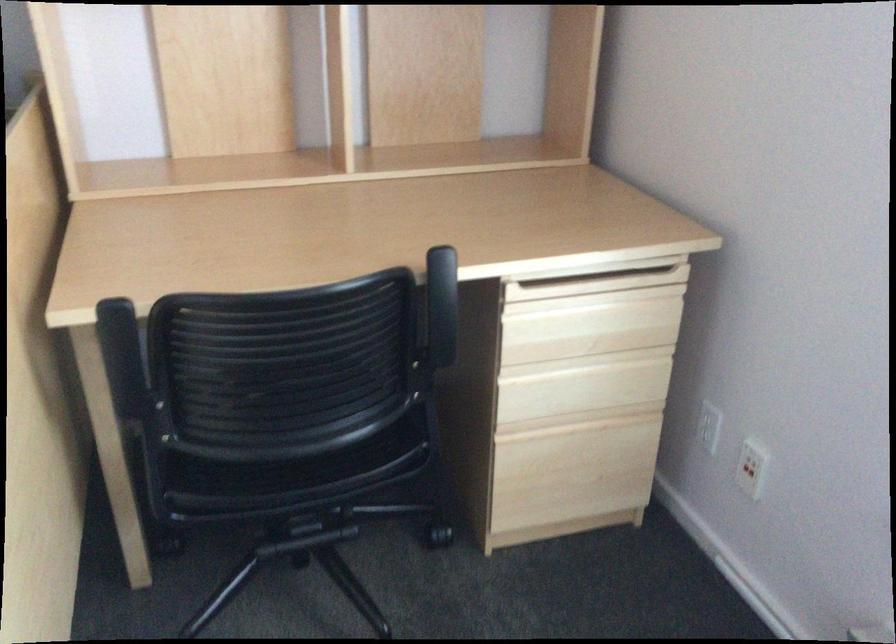
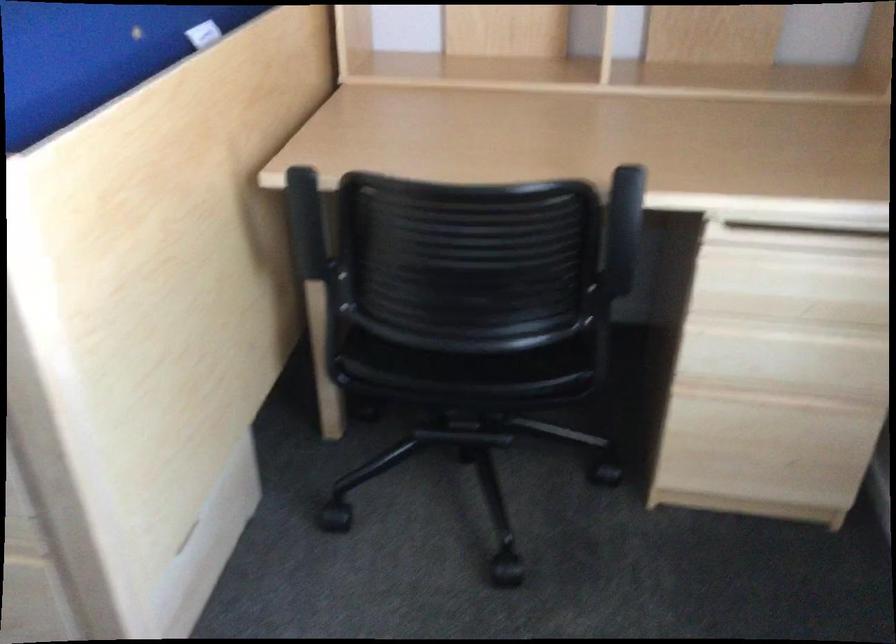
Question: The camera is either moving clockwise (left) or counter-clockwise (right) around the object. The first image is from the beginning of the video and the second image is from the end. Is the camera moving left or right when shooting the video?

Choices:
 (A) Left
 (B) Right

Answer: (B)